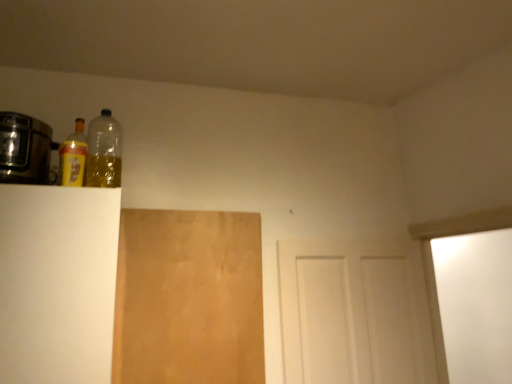
Question: Considering the relative sizes of white matte door at center and brown matte plywood at center-left in the image provided, is white matte door at center bigger than brown matte plywood at center-left?

Choices:
 (A) no
 (B) yes

Answer: (B)

Question: Is white matte door at center thinner than brown matte plywood at center-left?

Choices:
 (A) no
 (B) yes

Answer: (A)

Question: Is white matte door at center not close to brown matte plywood at center-left?

Choices:
 (A) yes
 (B) no

Answer: (B)

Question: From the image's perspective, would you say white matte door at center is shown under brown matte plywood at center-left?

Choices:
 (A) yes
 (B) no

Answer: (A)

Question: Is white matte door at center completely or partially outside of brown matte plywood at center-left?

Choices:
 (A) no
 (B) yes

Answer: (B)

Question: Are white matte door at center and brown matte plywood at center-left making contact?

Choices:
 (A) no
 (B) yes

Answer: (A)

Question: Is white matte door at center aimed at yellow matte bottle at upper left, which is counted as the 1th bottle, starting from the left?

Choices:
 (A) no
 (B) yes

Answer: (A)

Question: Is white matte door at center next to yellow matte bottle at upper left, marked as the 2th bottle in a right-to-left arrangement, and touching it?

Choices:
 (A) yes
 (B) no

Answer: (B)

Question: Does white matte door at center lie behind yellow matte bottle at upper left, which is counted as the 1th bottle, starting from the left?

Choices:
 (A) yes
 (B) no

Answer: (A)

Question: Is white matte door at center oriented away from yellow matte bottle at upper left, marked as the 2th bottle in a right-to-left arrangement?

Choices:
 (A) yes
 (B) no

Answer: (B)

Question: From the image's perspective, is white matte door at center on top of yellow matte bottle at upper left, marked as the 2th bottle in a right-to-left arrangement?

Choices:
 (A) yes
 (B) no

Answer: (B)

Question: Can you confirm if white matte door at center is bigger than yellow matte bottle at upper left, marked as the 2th bottle in a right-to-left arrangement?

Choices:
 (A) yes
 (B) no

Answer: (A)

Question: Is brown matte plywood at center-left surrounding white matte door at center?

Choices:
 (A) yes
 (B) no

Answer: (B)